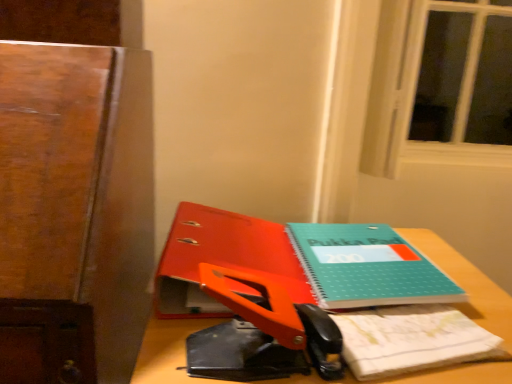
Question: Is teal matte notebook at center at the back of wooden desk at center?

Choices:
 (A) yes
 (B) no

Answer: (B)

Question: Does wooden desk at center have a larger size compared to teal matte notebook at center?

Choices:
 (A) yes
 (B) no

Answer: (A)

Question: Can you see wooden desk at center touching teal matte notebook at center?

Choices:
 (A) no
 (B) yes

Answer: (A)

Question: Is wooden desk at center smaller than teal matte notebook at center?

Choices:
 (A) yes
 (B) no

Answer: (B)

Question: Can you confirm if wooden desk at center is positioned to the left of teal matte notebook at center?

Choices:
 (A) no
 (B) yes

Answer: (B)

Question: Based on their positions, is orange plastic scissors at center located to the left or right of teal matte notebook at center?

Choices:
 (A) right
 (B) left

Answer: (B)

Question: Is point (222, 274) closer or farther from the camera than point (373, 251)?

Choices:
 (A) farther
 (B) closer

Answer: (B)

Question: Do you think orange plastic scissors at center is within teal matte notebook at center, or outside of it?

Choices:
 (A) outside
 (B) inside

Answer: (A)

Question: Is orange plastic scissors at center bigger or smaller than teal matte notebook at center?

Choices:
 (A) small
 (B) big

Answer: (B)

Question: In the image, is teal matte notebook at center on the left side or the right side of teal matte notepad at center?

Choices:
 (A) right
 (B) left

Answer: (B)

Question: Is teal matte notebook at center in front of or behind teal matte notepad at center in the image?

Choices:
 (A) behind
 (B) front

Answer: (A)

Question: Does point (247, 221) appear closer or farther from the camera than point (451, 357)?

Choices:
 (A) closer
 (B) farther

Answer: (B)

Question: From a real-world perspective, is teal matte notebook at center physically located above or below teal matte notepad at center?

Choices:
 (A) below
 (B) above

Answer: (B)

Question: Would you say teal matte notepad at center is to the left or to the right of orange plastic scissors at center in the picture?

Choices:
 (A) left
 (B) right

Answer: (B)

Question: Is point (357, 357) positioned closer to the camera than point (287, 342)?

Choices:
 (A) closer
 (B) farther

Answer: (B)